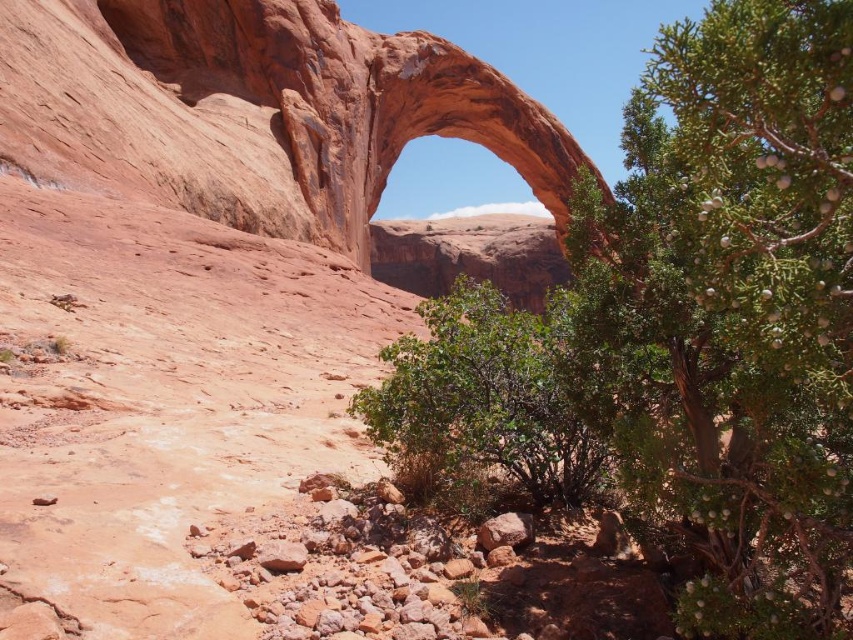
Question: Can you confirm if green leafy tree at center is smaller than rustic sandstone arch at center?

Choices:
 (A) yes
 (B) no

Answer: (A)

Question: Is green leafy tree at center above rustic sandstone arch at center?

Choices:
 (A) no
 (B) yes

Answer: (A)

Question: Is green leafy tree at center closer to camera compared to rustic sandstone arch at center?

Choices:
 (A) yes
 (B) no

Answer: (A)

Question: Which object is closer to the camera taking this photo?

Choices:
 (A) green leafy tree at center
 (B) rustic sandstone arch at center

Answer: (A)